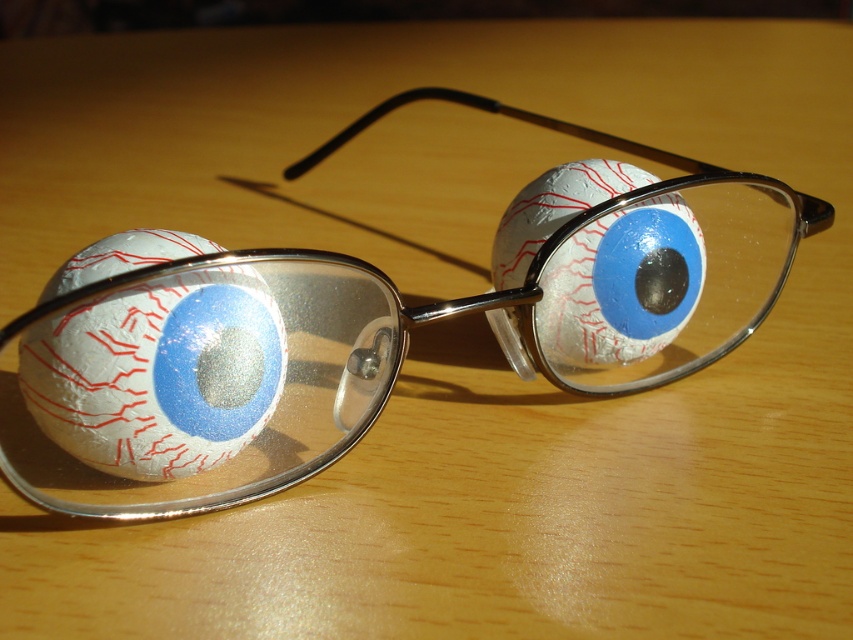
Who is positioned more to the right, metallic silver goggles at center or matte white eyeball at center?

From the viewer's perspective, matte white eyeball at center appears more on the right side.

Does point (41, 388) come behind point (498, 280)?

No, (41, 388) is closer to viewer.

Between point (105, 476) and point (581, 289), which one is positioned in front?

Point (105, 476) is in front.

Find the location of a particular element. metallic silver goggles at center is located at coordinates (366, 337).

Is white matte eyeball at center positioned at the back of matte white eyeball at center?

No, it is not.

Can you confirm if white matte eyeball at center is wider than matte white eyeball at center?

In fact, white matte eyeball at center might be narrower than matte white eyeball at center.

Does point (137, 296) come in front of point (651, 205)?

Yes.

Find the location of a particular element. This screenshot has width=853, height=640. white matte eyeball at center is located at coordinates (157, 372).

Which of these two, metallic silver goggles at center or white matte eyeball at center, stands shorter?

white matte eyeball at center

Who is more distant from viewer, (767, 310) or (154, 419)?

The point (767, 310) is more distant.

Is point (584, 234) more distant than point (241, 275)?

Yes, it is behind point (241, 275).

Identify the location of metallic silver goggles at center. This screenshot has width=853, height=640. (366, 337).